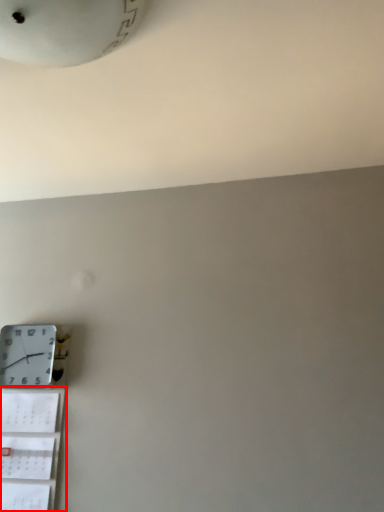
Question: From the image, what is the correct spatial relationship of shelf (annotated by the red box) in relation to wall clock?

Choices:
 (A) left
 (B) right

Answer: (B)